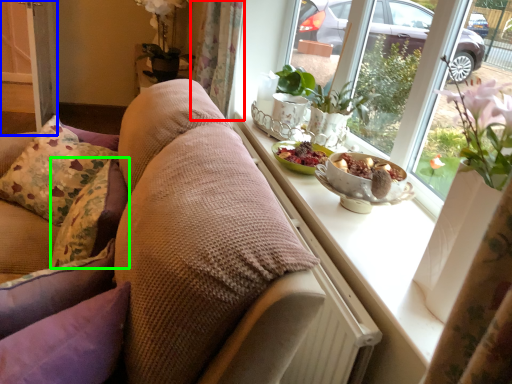
Question: Considering the real-world distances, which object is closest to curtain (highlighted by a red box)? screen door (highlighted by a blue box) or pillow (highlighted by a green box).

Choices:
 (A) screen door
 (B) pillow

Answer: (B)